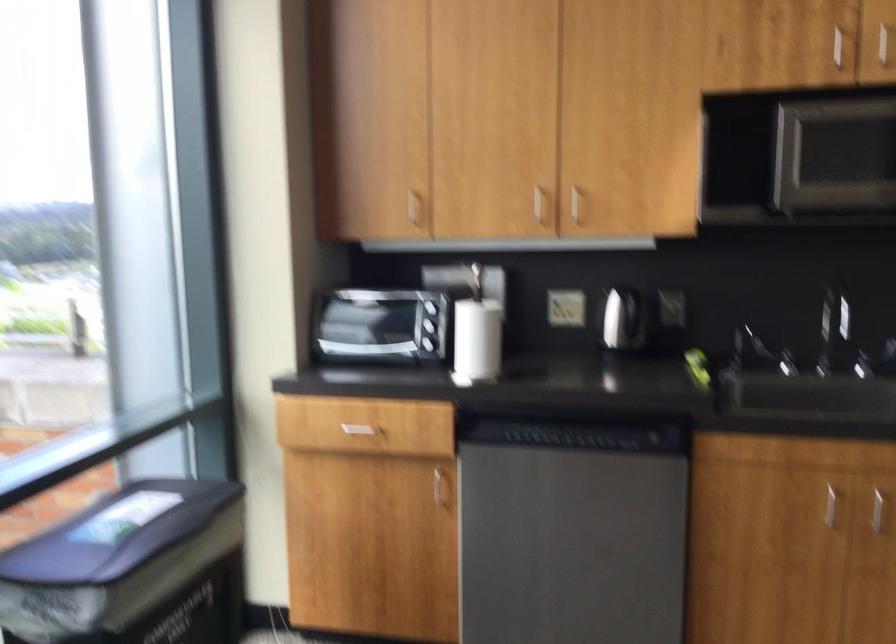
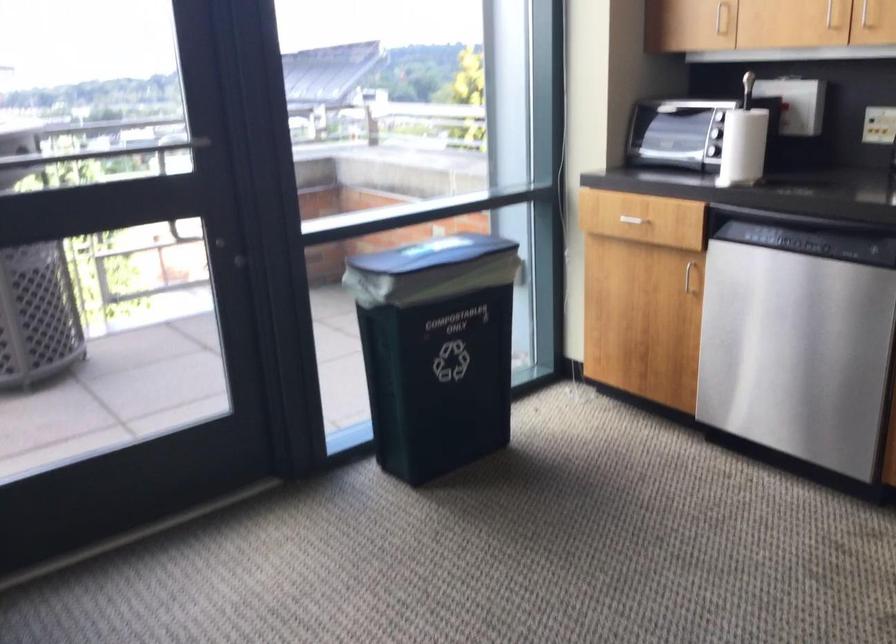
Where in the second image is the point corresponding to point 486,341 from the first image?

(743, 146)